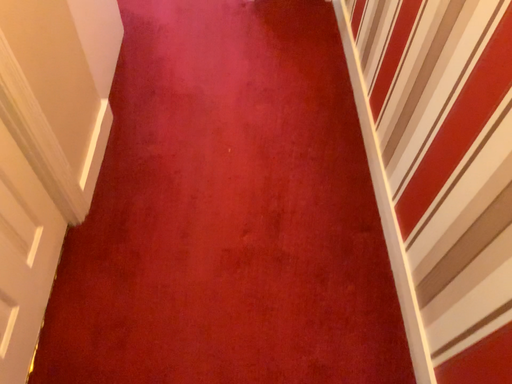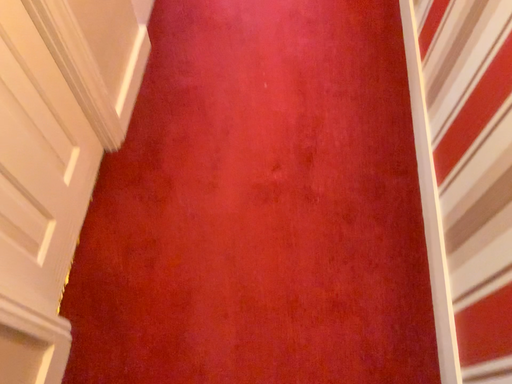
Question: How did the camera likely rotate when shooting the video?

Choices:
 (A) rotated upward
 (B) rotated downward

Answer: (B)